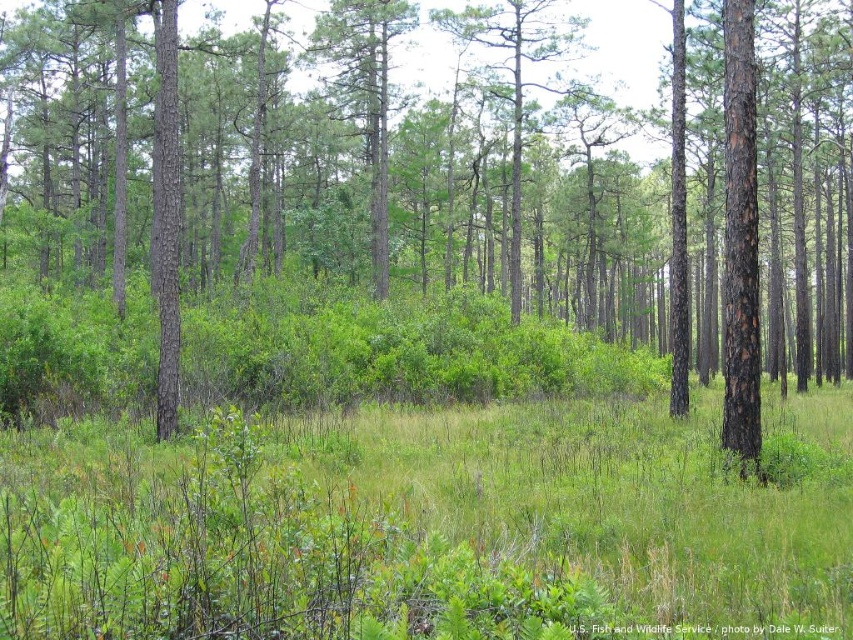
Question: Is the position of brown rough tree at center less distant than that of green grassy at center?

Choices:
 (A) no
 (B) yes

Answer: (A)

Question: Which object is farther from the camera taking this photo?

Choices:
 (A) green grassy at center
 (B) brown rough tree at center

Answer: (B)

Question: Where is brown rough tree at center located in relation to green grassy at center in the image?

Choices:
 (A) left
 (B) right

Answer: (A)

Question: Is brown rough tree at center thinner than green grassy at center?

Choices:
 (A) yes
 (B) no

Answer: (B)